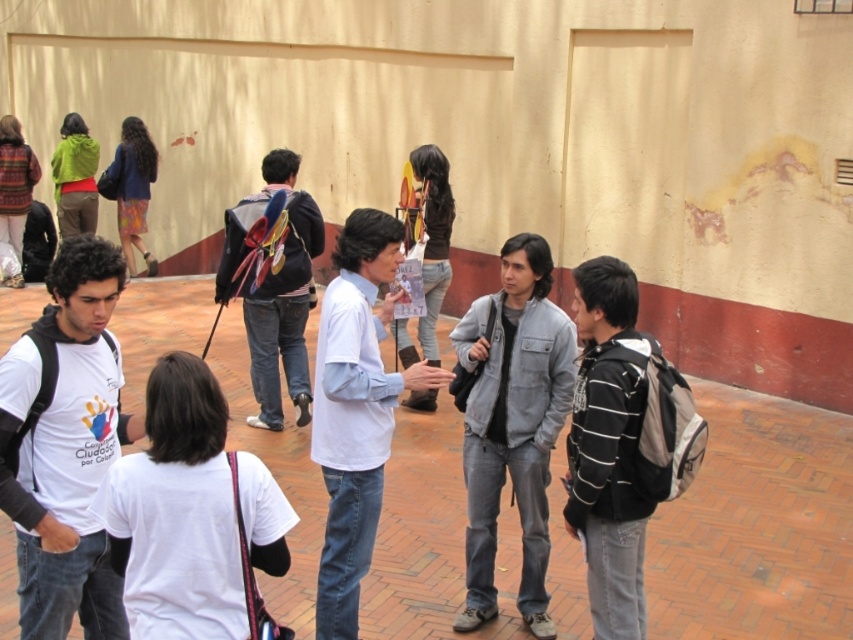
You are standing at the point labeled as point (416, 385) and want to move to the point labeled as point (169, 433). Which direction should you move in to reach your destination?

You should move forward to reach point (169, 433) because it is in front of point (416, 385).